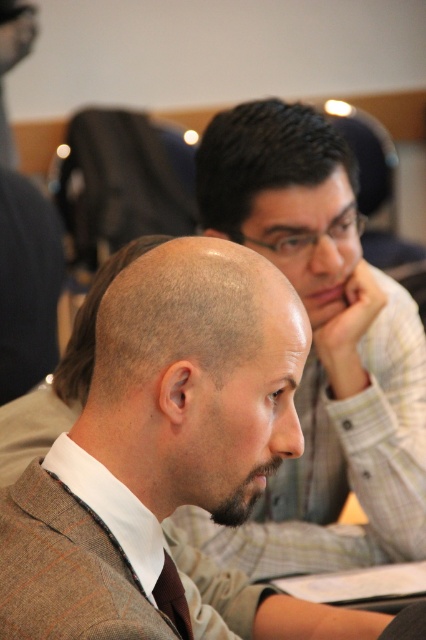
Does brown hair at center have a larger size compared to brown woven tie at center?

Indeed, brown hair at center has a larger size compared to brown woven tie at center.

From the picture: Can you confirm if brown hair at center is positioned below brown woven tie at center?

Actually, brown hair at center is above brown woven tie at center.

Where is `brown hair at center`? The width and height of the screenshot is (426, 640). brown hair at center is located at coordinates (195, 378).

Is brown hair at center above dark brown beard at center?

Yes.

Does point (144, 317) come in front of point (276, 456)?

Yes, it is in front of point (276, 456).

Find the location of `brown hair at center`. brown hair at center is located at coordinates (195, 378).

Between brown hair at center and matte gray shirt at center, which one appears on the right side from the viewer's perspective?

matte gray shirt at center

Can you confirm if brown hair at center is shorter than matte gray shirt at center?

Correct, brown hair at center is not as tall as matte gray shirt at center.

Locate an element on the screen. The image size is (426, 640). brown hair at center is located at coordinates (195, 378).